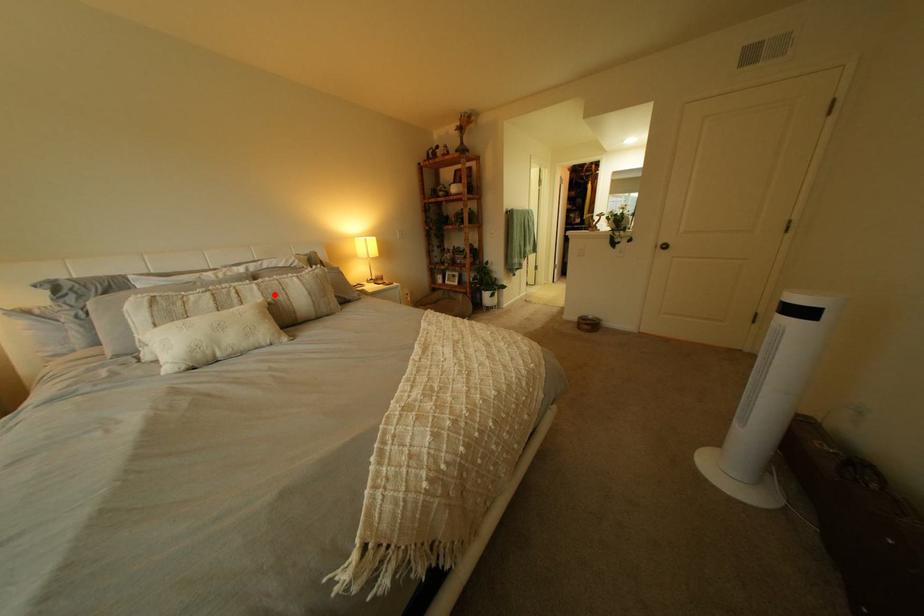
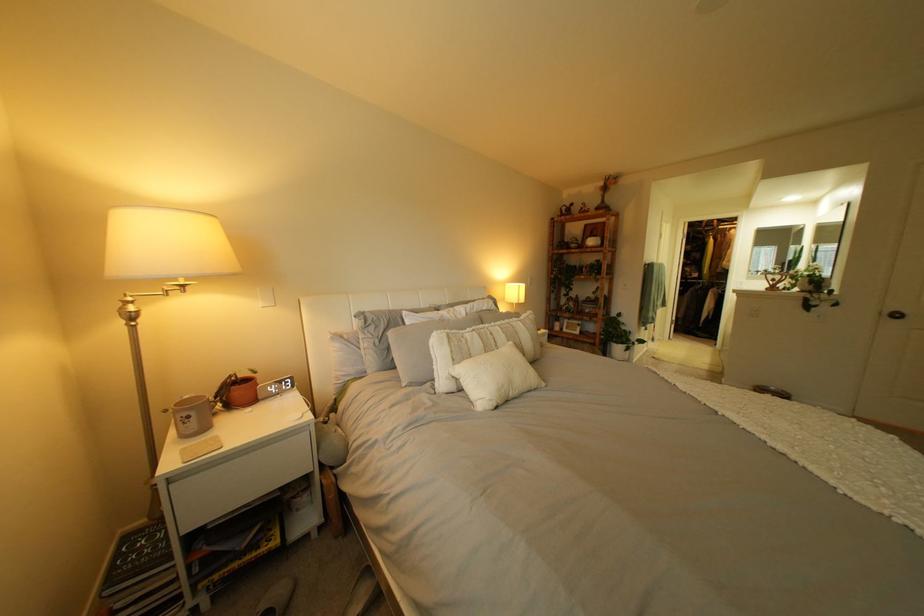
The point at the highlighted location is marked in the first image. Where is the corresponding point in the second image?

(518, 337)